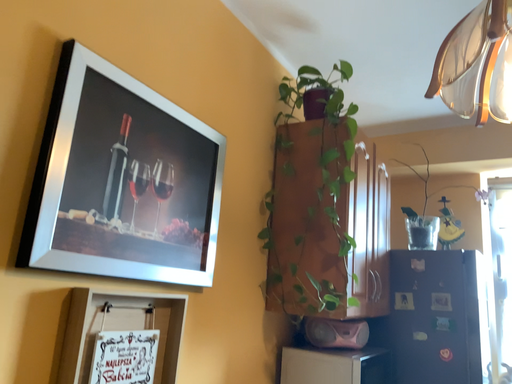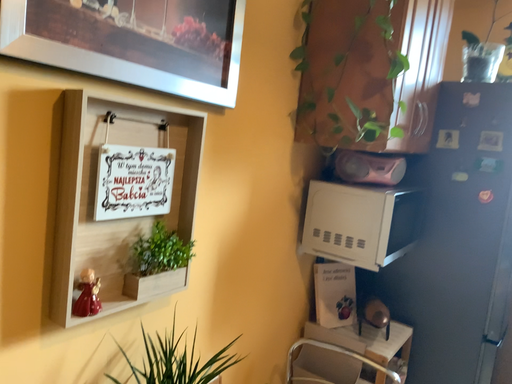
Question: How did the camera likely rotate when shooting the video?

Choices:
 (A) rotated downward
 (B) rotated upward

Answer: (A)